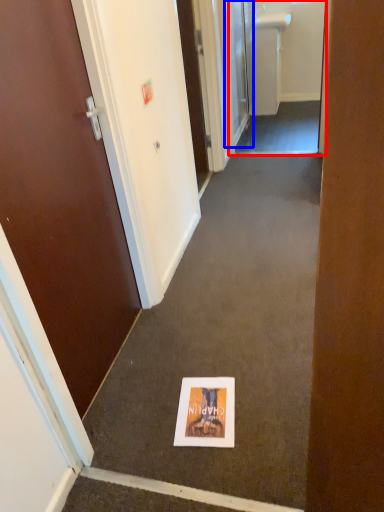
Question: Which object appears farthest to the camera in this image, passage (highlighted by a red box) or door (highlighted by a blue box)?

Choices:
 (A) passage
 (B) door

Answer: (B)